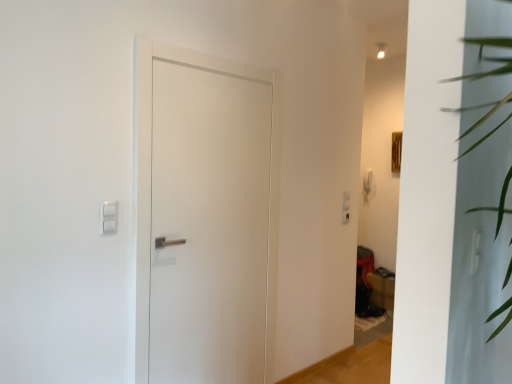
Question: Considering the positions of white matte door at center and matte brown cardboard box at lower right in the image, is white matte door at center bigger or smaller than matte brown cardboard box at lower right?

Choices:
 (A) small
 (B) big

Answer: (B)

Question: In terms of height, does white matte door at center look taller or shorter compared to matte brown cardboard box at lower right?

Choices:
 (A) short
 (B) tall

Answer: (B)

Question: Considering the real-world distances, which object is closest to the white plastic light switch at upper left?

Choices:
 (A) white matte door at center
 (B) matte brown cardboard box at lower right

Answer: (A)

Question: Estimate the real-world distances between objects in this image. Which object is closer to the white matte door at center?

Choices:
 (A) matte brown cardboard box at lower right
 (B) white plastic light switch at upper left

Answer: (B)